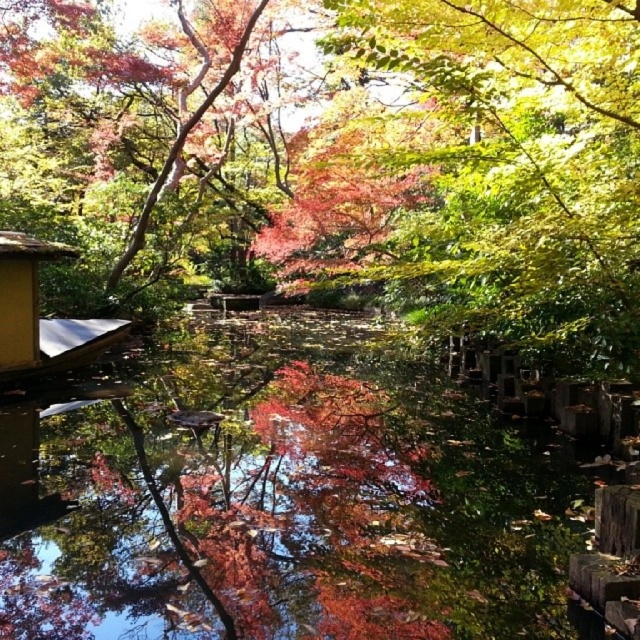
You are standing in the Japanese garden and notice two points marked on the ground. The first point is at coordinates point (90, 58) and the second is at point (17, 547). Which point is farther away from you if you are facing the direction of the pond?

Point (90, 58) is behind point (17, 547), so if you are facing the pond, point (90, 58) is farther away from you.

You are a visitor in the Japanese garden and want to take a photo of the yellow wood hut at lower left without the transparent water at center appearing in the background. Is this possible given their positions?

The transparent water at center is positioned under yellow wood hut at lower left, so it would be challenging to avoid the transparent water at center in the background when photographing the yellow wood hut at lower left.